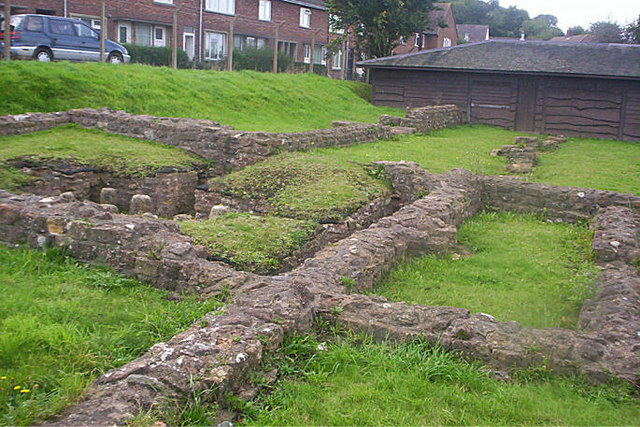
You are a GUI agent. You are given a task and a screenshot of the screen. Output one action in this format:
    pyautogui.click(x=<x>, y=<y>)
    Task: Click on the handle
    The image size is (640, 427).
    Given the screenshot: What is the action you would take?
    pyautogui.click(x=66, y=49), pyautogui.click(x=98, y=45)